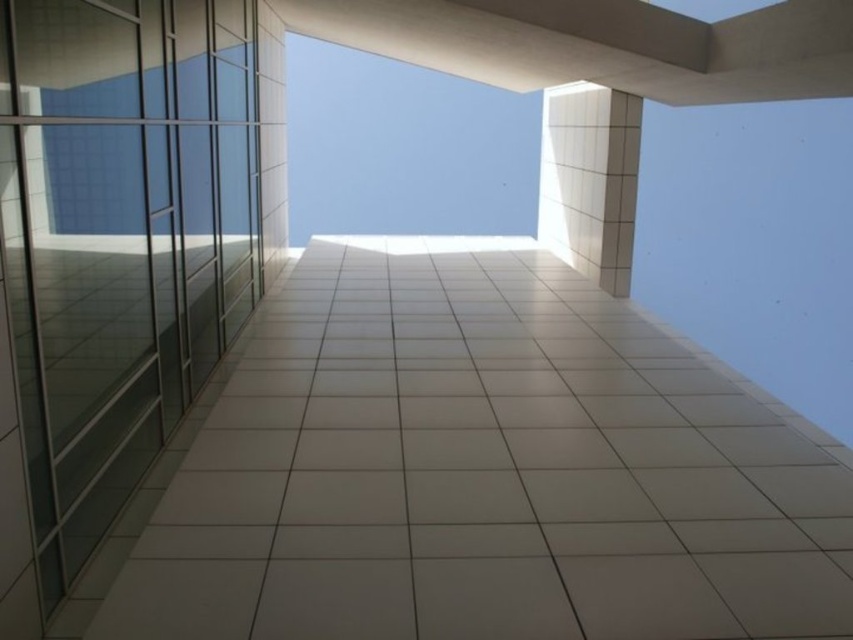
Looking at this image, you are standing at the base of the building and want to take the transparent glass elevator at left to reach the white tile pillar at upper right. Can you see the pillar from inside the elevator while moving upwards?

Yes, because the transparent glass elevator at left is positioned to the left of the white tile pillar at upper right, you can see the pillar as you ascend.

You are standing at the base of this modern building and notice the transparent glass elevator at left and the white tile pillar at upper right. Which object appears shorter from your vantage point?

The transparent glass elevator at left appears shorter than the white tile pillar at upper right because it is not as tall as the pillar.

You are an architect examining this building from below. You notice the transparent glass elevator at left and the white tile pillar at upper right. Which of these two objects appears to be smaller in size when viewed from your current perspective?

The transparent glass elevator at left appears smaller in size compared to the white tile pillar at upper right when viewed from below.